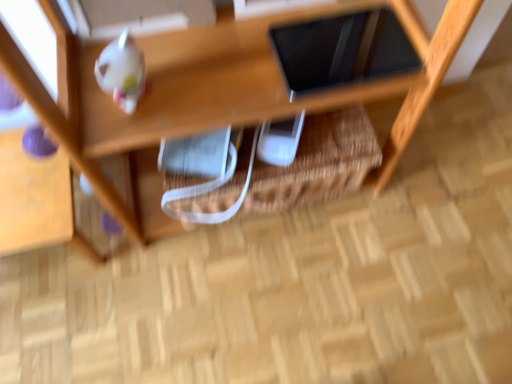
This screenshot has width=512, height=384. What are the coordinates of `empty space that is ontop of wooden shelf at upper center (from a real-world perspective)` in the screenshot? It's located at (333, 260).